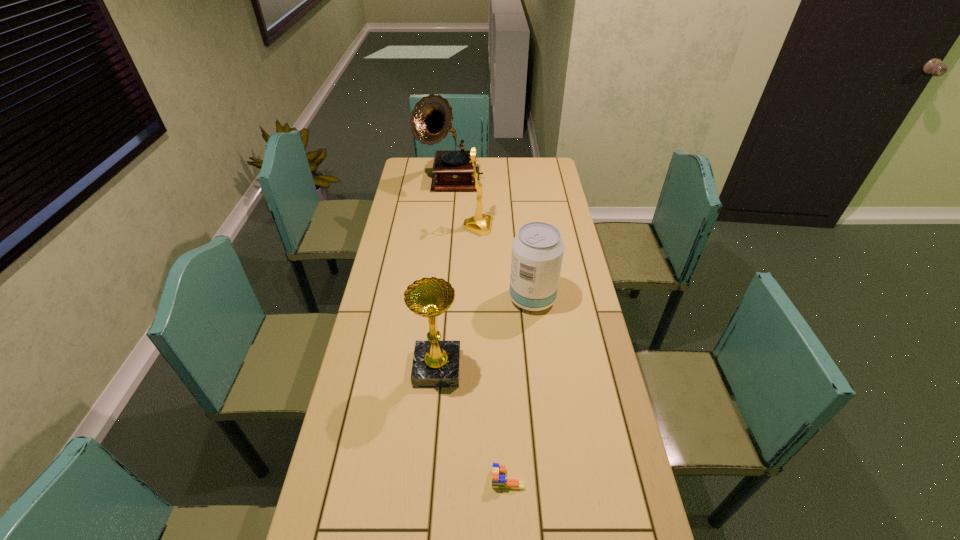
Where is `free space located on the left of the alcohol`? This screenshot has height=540, width=960. free space located on the left of the alcohol is located at coordinates (472, 299).

This screenshot has width=960, height=540. Find the location of `free space located 0.110m on the back of the nearest object`. free space located 0.110m on the back of the nearest object is located at coordinates (506, 428).

Image resolution: width=960 pixels, height=540 pixels. Identify the location of object that is at the far edge. (431, 119).

Where is `object present at the left edge`? The height and width of the screenshot is (540, 960). object present at the left edge is located at coordinates (431, 119).

Find the location of a particular element. The height and width of the screenshot is (540, 960). object that is at the right edge is located at coordinates (537, 250).

Find the location of a particular element. object at the far left corner is located at coordinates (431, 119).

Identify the location of free space at the far edge of the desktop. The height and width of the screenshot is (540, 960). (516, 175).

Locate an element on the screen. blank space at the left edge of the desktop is located at coordinates click(403, 193).

Find the location of a particular element. The height and width of the screenshot is (540, 960). free space at the right edge of the desktop is located at coordinates (587, 291).

The height and width of the screenshot is (540, 960). Identify the location of empty space that is in between the farther award and the fourth farthest object. (457, 298).